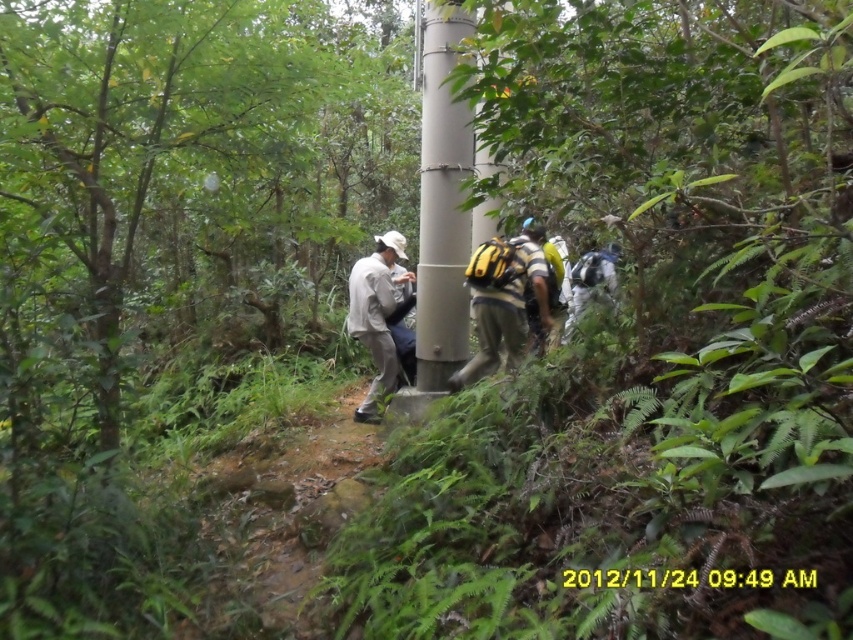
Question: Does gray metallic pole at center appear under white matte jacket at center?

Choices:
 (A) no
 (B) yes

Answer: (A)

Question: Is gray metallic pole at center positioned behind yellow fabric backpack at center?

Choices:
 (A) no
 (B) yes

Answer: (A)

Question: Which point appears farthest from the camera in this image?

Choices:
 (A) (387, 289)
 (B) (494, 339)

Answer: (A)

Question: Which of the following is the farthest from the observer?

Choices:
 (A) white matte jacket at center
 (B) yellow fabric backpack at center
 (C) gray metallic pole at center

Answer: (A)

Question: Estimate the real-world distances between objects in this image. Which object is farther from the white matte jacket at center?

Choices:
 (A) yellow fabric backpack at center
 (B) gray metallic pole at center

Answer: (A)

Question: Is gray metallic pole at center below white matte jacket at center?

Choices:
 (A) no
 (B) yes

Answer: (A)